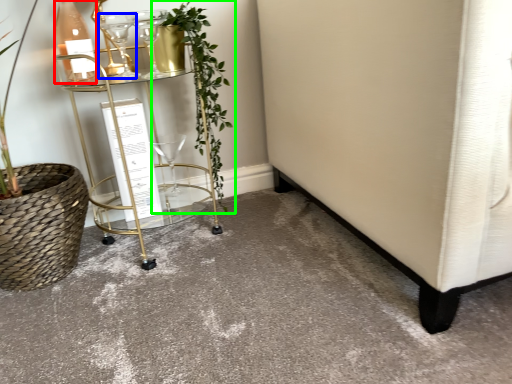
Question: Considering the real-world distances, which object is farthest from bottle (highlighted by a red box)? wine glass (highlighted by a blue box) or houseplant (highlighted by a green box)?

Choices:
 (A) wine glass
 (B) houseplant

Answer: (B)